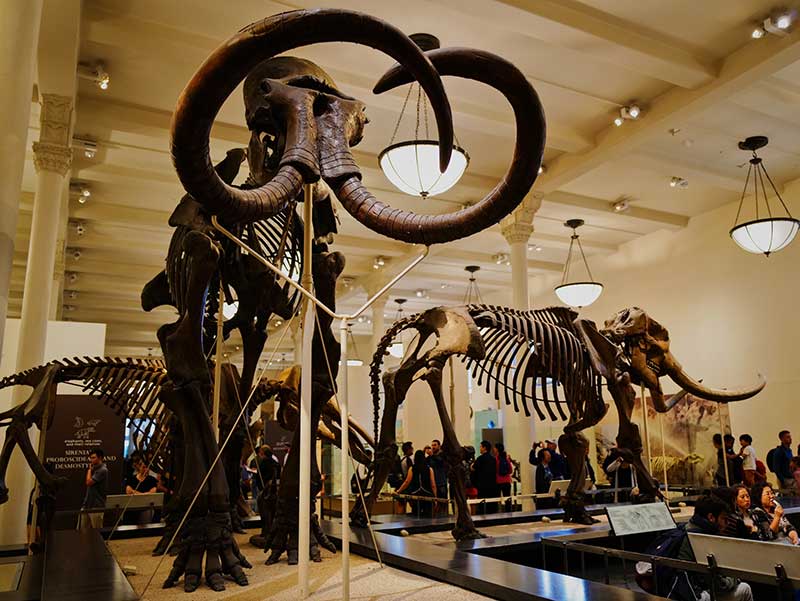
At what (x,y) coordinates should I click in order to perform the action: click on wall right side. Please return your answer as a coordinate pair (x, y). Image resolution: width=800 pixels, height=601 pixels. Looking at the image, I should click on (734, 355).